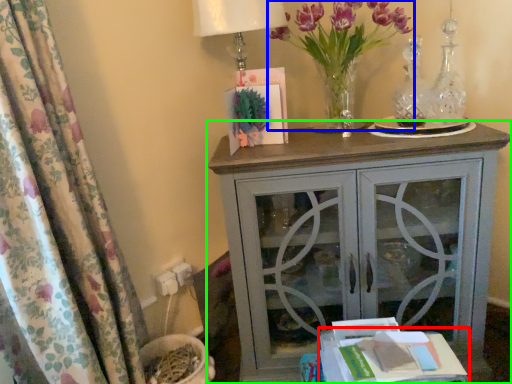
Question: Which object is positioned closest to table (highlighted by a red box)? Select from floral arrangement (highlighted by a blue box) and nightstand (highlighted by a green box).

Choices:
 (A) floral arrangement
 (B) nightstand

Answer: (B)